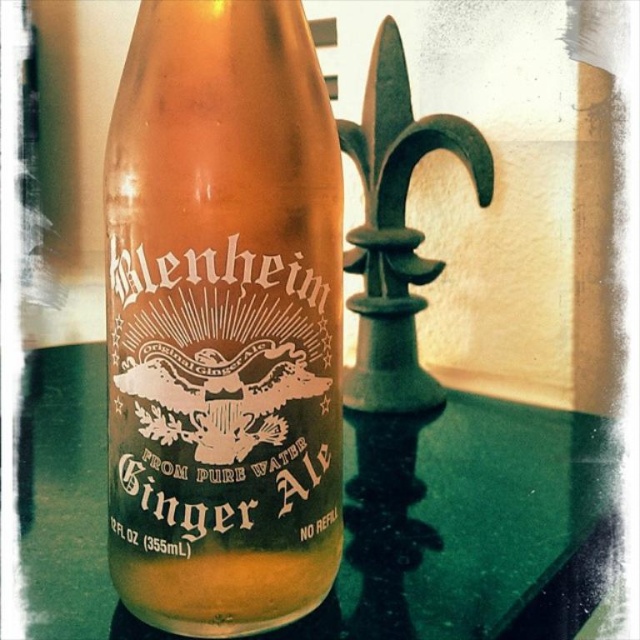
Who is more distant from viewer, [200,579] or [93,424]?

The point [93,424] is behind.

Is translucent amber glass ginger ale at center taller than green glass bottle at center?

Yes, translucent amber glass ginger ale at center is taller than green glass bottle at center.

The image size is (640, 640). In order to click on translucent amber glass ginger ale at center in this screenshot , I will do `click(221, 320)`.

Locate an element on the screen. Image resolution: width=640 pixels, height=640 pixels. translucent amber glass ginger ale at center is located at coordinates (221, 320).